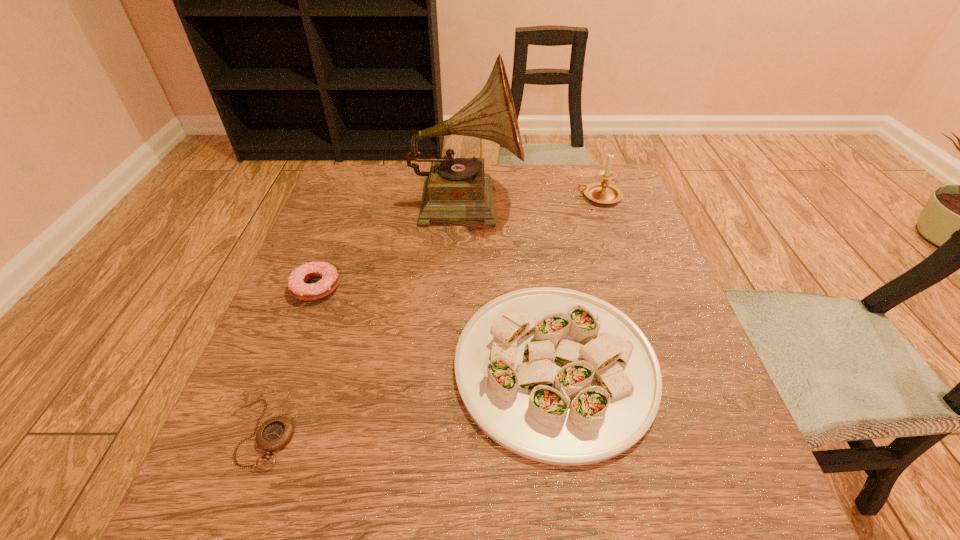
The image size is (960, 540). Find the location of `vacant area that lies between the shortest object and the platter`. vacant area that lies between the shortest object and the platter is located at coordinates tap(409, 400).

At what (x,y) coordinates should I click in order to perform the action: click on vacant area that lies between the pocket watch and the doughnut. Please return your answer as a coordinate pair (x, y). The width and height of the screenshot is (960, 540). Looking at the image, I should click on (290, 361).

Locate an element on the screen. The image size is (960, 540). free point between the second shortest object and the platter is located at coordinates (436, 327).

Find the location of a particular element. free space between the pocket watch and the second shortest object is located at coordinates (290, 361).

At what (x,y) coordinates should I click in order to perform the action: click on vacant area that lies between the candle holder and the platter. Please return your answer as a coordinate pair (x, y). This screenshot has width=960, height=540. Looking at the image, I should click on click(x=577, y=281).

The width and height of the screenshot is (960, 540). I want to click on free spot between the fourth shortest object and the tallest object, so click(533, 199).

You are a GUI agent. You are given a task and a screenshot of the screen. Output one action in this format:
    pyautogui.click(x=<x>, y=<y>)
    Task: Click on the blank region between the candle holder and the doughnut
    The image size is (960, 540).
    Given the screenshot: What is the action you would take?
    tap(457, 242)

Find the location of a particular element. vacant area that lies between the record player and the candle holder is located at coordinates (533, 199).

This screenshot has width=960, height=540. Find the location of `object that is the closest one to the tallest object`. object that is the closest one to the tallest object is located at coordinates (602, 192).

Image resolution: width=960 pixels, height=540 pixels. In order to click on object that is the fourth closest to the third tallest object in this screenshot , I will do `click(602, 192)`.